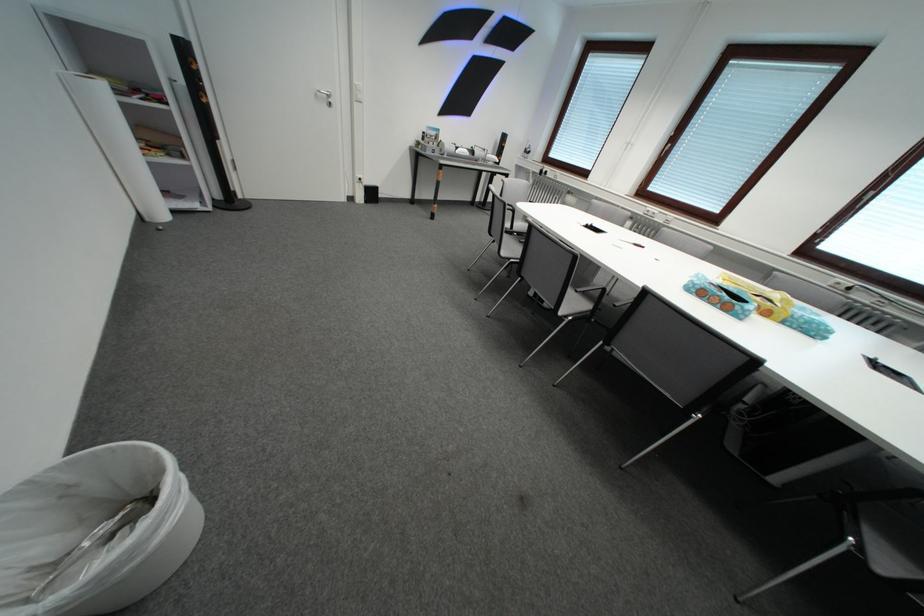
This screenshot has width=924, height=616. Identify the location of white light switch. (358, 92).